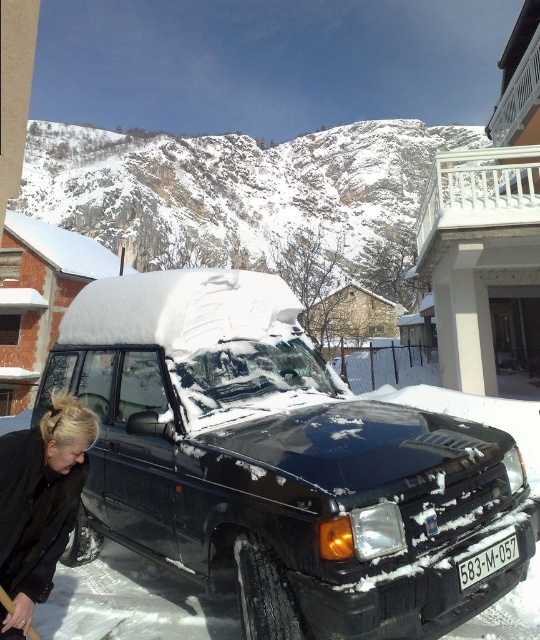
Question: Among these points, which one is farthest from the camera?

Choices:
 (A) (464, 588)
 (B) (173, 332)

Answer: (B)

Question: Which object is closer to the camera taking this photo?

Choices:
 (A) blonde hair at lower left
 (B) black plastic license plate at lower center

Answer: (A)

Question: Does black matte van at center appear on the left side of blonde hair at lower left?

Choices:
 (A) no
 (B) yes

Answer: (A)

Question: Does black matte van at center have a greater width compared to blonde hair at lower left?

Choices:
 (A) yes
 (B) no

Answer: (A)

Question: Can you confirm if blonde hair at lower left is positioned to the right of black plastic license plate at lower center?

Choices:
 (A) no
 (B) yes

Answer: (A)

Question: Among these points, which one is nearest to the camera?

Choices:
 (A) (491, 438)
 (B) (9, 470)

Answer: (B)